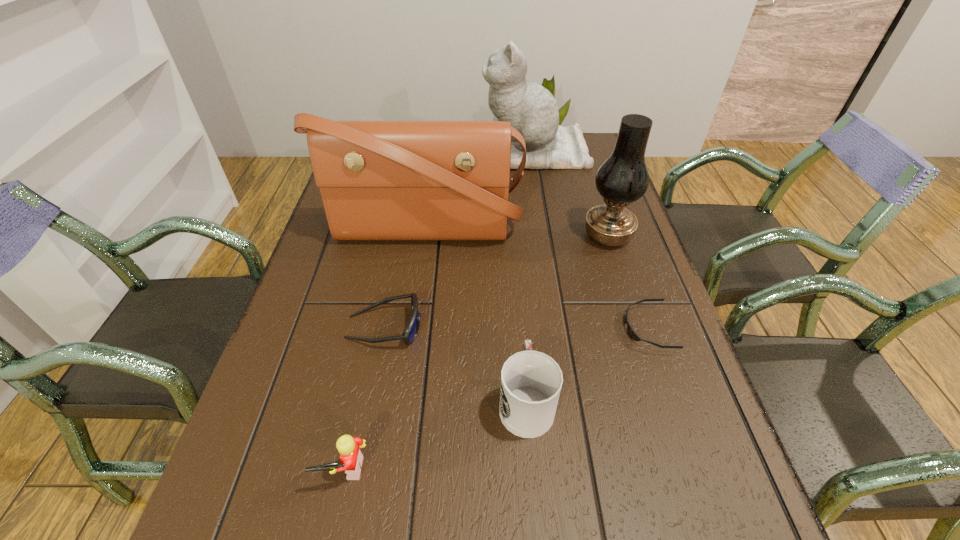
I want to click on free space that is in between the second nearest object and the shortest object, so click(x=587, y=364).

In order to click on empty space that is in between the farthest object and the shortest object in this screenshot , I will do `click(591, 240)`.

This screenshot has width=960, height=540. Identify the location of the fourth closest object relative to the right sunglasses. 412,329.

This screenshot has height=540, width=960. I want to click on the sixth closest object to the sixth tallest object, so click(x=531, y=109).

I want to click on vacant space that satisfies the following two spatial constraints: 1. on the front-facing side of the taller sunglasses; 2. in front of the Lego with the accessory visible, so click(357, 469).

Find the location of `free space in the image that satisfies the following two spatial constraints: 1. on the front-facing side of the cat; 2. on the left side of the oil lamp`. free space in the image that satisfies the following two spatial constraints: 1. on the front-facing side of the cat; 2. on the left side of the oil lamp is located at coordinates click(549, 236).

Identify the location of vacant area that satisfies the following two spatial constraints: 1. on the handle side of the sixth farthest object; 2. on the front-facing side of the taller sunglasses. (520, 327).

The width and height of the screenshot is (960, 540). Find the location of `blank space that satisfies the following two spatial constraints: 1. on the front-facing side of the farthest object; 2. in front of the nearest object with the accessory visible`. blank space that satisfies the following two spatial constraints: 1. on the front-facing side of the farthest object; 2. in front of the nearest object with the accessory visible is located at coordinates (590, 469).

What are the coordinates of `vacant position in the image that satisfies the following two spatial constraints: 1. on the front-facing side of the oil lamp; 2. on the right side of the cat` in the screenshot? It's located at (549, 236).